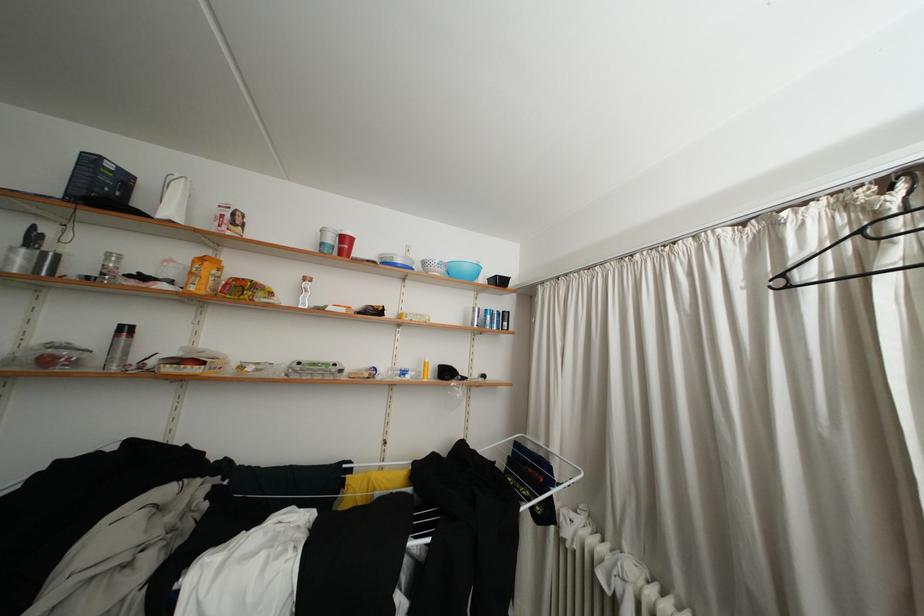
Describe the element at coordinates (463, 270) in the screenshot. I see `the light blue bowl` at that location.